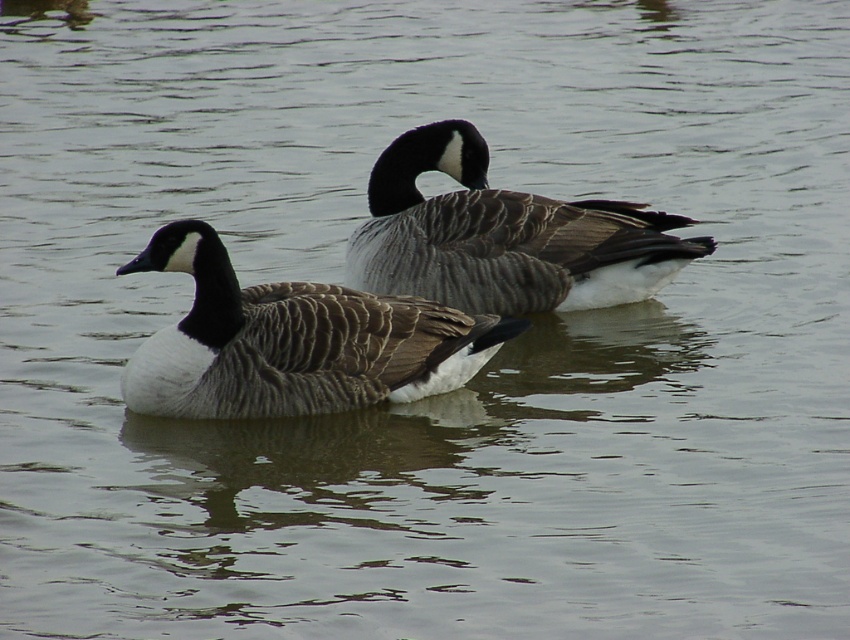
From the picture: Can you confirm if brown textured goose at left is positioned to the left of gray feathered goose at center?

Indeed, brown textured goose at left is positioned on the left side of gray feathered goose at center.

Between point (165, 246) and point (386, 157), which one is positioned behind?

The point (386, 157) is behind.

Is point (298, 314) less distant than point (465, 269)?

Yes.

Locate an element on the screen. The width and height of the screenshot is (850, 640). brown textured goose at left is located at coordinates (293, 340).